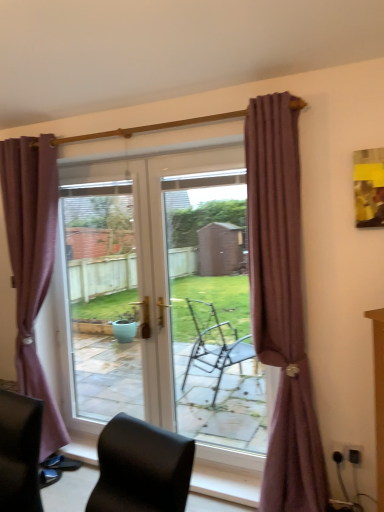
Locate an element on the screen. The height and width of the screenshot is (512, 384). vacant area on top of transparent glass door at center (from a real-world perspective) is located at coordinates (93, 186).